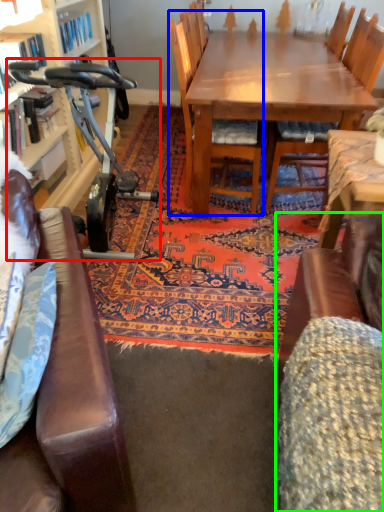
Question: Which object is the closest to the sport equipment (highlighted by a red box)? Choose among these: chair (highlighted by a blue box) or swivel chair (highlighted by a green box).

Choices:
 (A) chair
 (B) swivel chair

Answer: (A)